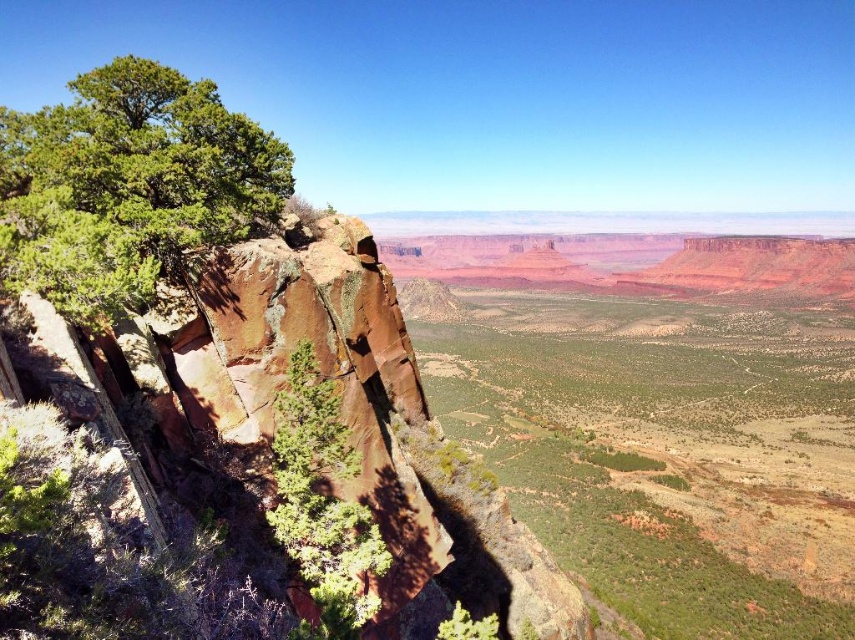
Can you confirm if green rough bark tree at left is positioned to the left of green matte tree at center-left?

Indeed, green rough bark tree at left is positioned on the left side of green matte tree at center-left.

I want to click on green rough bark tree at left, so click(130, 188).

Find the location of a particular element. This screenshot has height=640, width=855. green rough bark tree at left is located at coordinates (130, 188).

Locate an element on the screen. green rough bark tree at left is located at coordinates (130, 188).